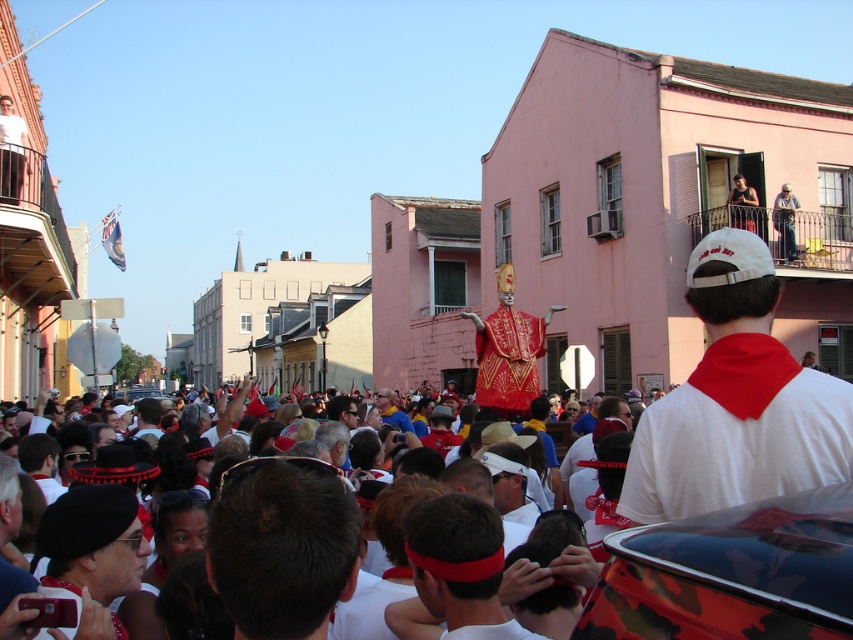
You are standing at the point marked as point (699, 576) in the image. You want to take a photo of the pink building with the balcony where the two people are standing. The camera you have can focus on objects up to 60 feet away. Will you be able to capture the pink building in focus?

The distance between point (699, 576) and the camera is 61.70 feet, which exceeds the camera maximum focus range of 60 feet. Therefore, the pink building will not be in focus.